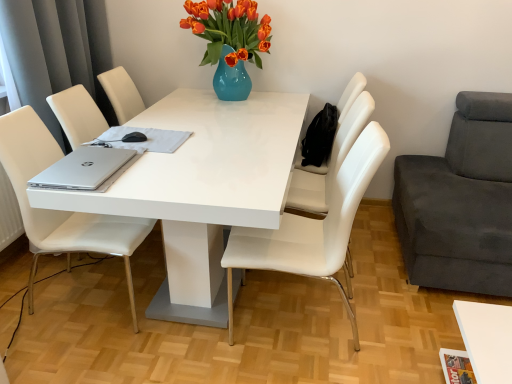
Where is `free spot in front of white cloth at center`? The image size is (512, 384). free spot in front of white cloth at center is located at coordinates (156, 168).